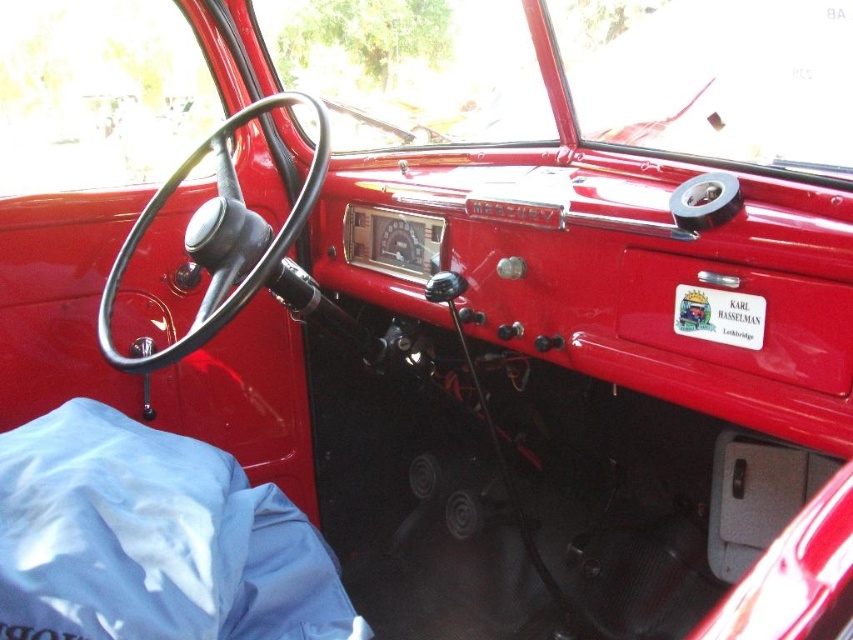
Consider the image. Is black leather steering wheel at center above white sticker at center?

Yes, black leather steering wheel at center is above white sticker at center.

Based on the photo, does black leather steering wheel at center have a larger size compared to white sticker at center?

Yes, black leather steering wheel at center is bigger than white sticker at center.

Who is more distant from viewer, (119, 362) or (757, 317)?

The point (119, 362) is behind.

At what (x,y) coordinates should I click in order to perform the action: click on black leather steering wheel at center. Please return your answer as a coordinate pair (x, y). The height and width of the screenshot is (640, 853). Looking at the image, I should click on (x=253, y=266).